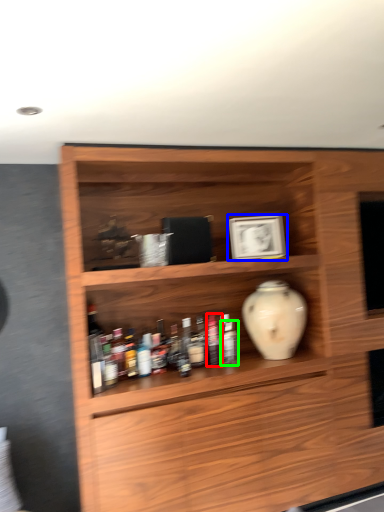
Question: Estimate the real-world distances between objects in this image. Which object is farther from bottle (highlighted by a red box), picture frame (highlighted by a blue box) or bottle (highlighted by a green box)?

Choices:
 (A) picture frame
 (B) bottle

Answer: (A)